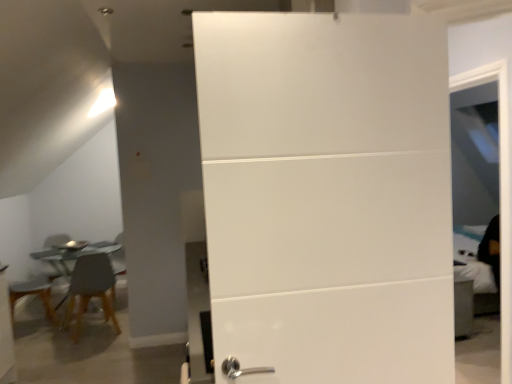
Question: From the image's perspective, does matte brown wooden chair at left appear lower than white glossy door at center?

Choices:
 (A) no
 (B) yes

Answer: (B)

Question: Is matte brown wooden chair at left bigger than white glossy door at center?

Choices:
 (A) yes
 (B) no

Answer: (A)

Question: Does matte brown wooden chair at left have a greater height compared to white glossy door at center?

Choices:
 (A) yes
 (B) no

Answer: (B)

Question: From a real-world perspective, is matte brown wooden chair at left over white glossy door at center?

Choices:
 (A) no
 (B) yes

Answer: (A)

Question: From the image's perspective, does matte brown wooden chair at left appear higher than white glossy door at center?

Choices:
 (A) no
 (B) yes

Answer: (A)

Question: In terms of size, does matte brown wooden chair at left appear bigger or smaller than metallic glass table at left?

Choices:
 (A) big
 (B) small

Answer: (B)

Question: From a real-world perspective, is matte brown wooden chair at left above or below metallic glass table at left?

Choices:
 (A) below
 (B) above

Answer: (B)

Question: Considering the positions of matte brown wooden chair at left and metallic glass table at left in the image, is matte brown wooden chair at left taller or shorter than metallic glass table at left?

Choices:
 (A) tall
 (B) short

Answer: (A)

Question: In terms of width, does matte brown wooden chair at left look wider or thinner when compared to metallic glass table at left?

Choices:
 (A) thin
 (B) wide

Answer: (A)

Question: In terms of width, does matte brown wooden chair at left look wider or thinner when compared to white glossy door at center?

Choices:
 (A) wide
 (B) thin

Answer: (A)

Question: From the image's perspective, is matte brown wooden chair at left located above or below white glossy door at center?

Choices:
 (A) above
 (B) below

Answer: (B)

Question: Which is correct: matte brown wooden chair at left is inside white glossy door at center, or outside of it?

Choices:
 (A) outside
 (B) inside

Answer: (A)

Question: Is matte brown wooden chair at left bigger or smaller than white glossy door at center?

Choices:
 (A) big
 (B) small

Answer: (A)

Question: Relative to metallic glass table at left, is white glossy door at center in front or behind?

Choices:
 (A) front
 (B) behind

Answer: (A)

Question: Is white glossy door at center inside or outside of metallic glass table at left?

Choices:
 (A) inside
 (B) outside

Answer: (B)